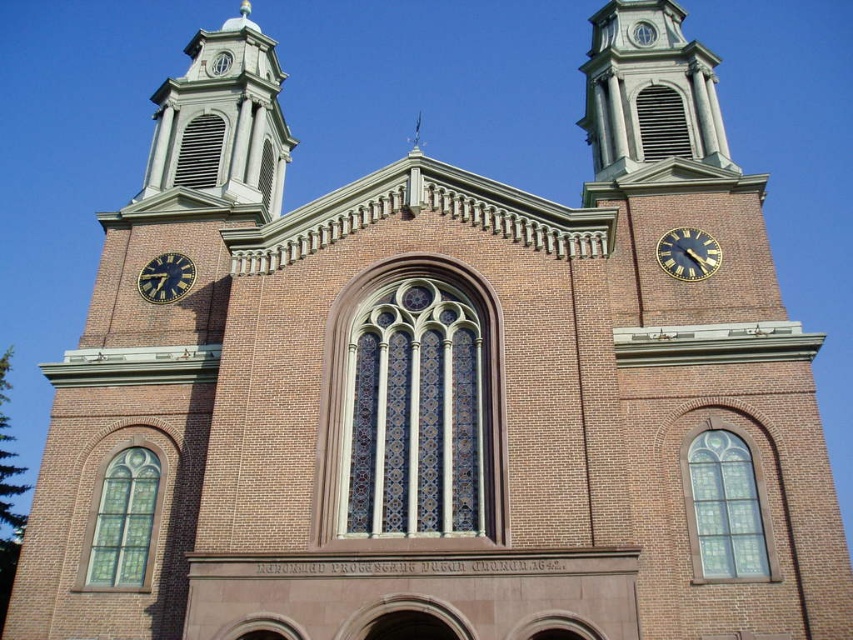
Question: Which of the following is the closest to the observer?

Choices:
 (A) gold metallic clock at upper right
 (B) gold metallic clock at lower left

Answer: (A)

Question: Can you confirm if gold metallic clock at upper right is smaller than gold metallic clock at lower left?

Choices:
 (A) no
 (B) yes

Answer: (A)

Question: Does gold metallic clock at upper right come in front of gold metallic clock at lower left?

Choices:
 (A) yes
 (B) no

Answer: (A)

Question: Can you confirm if gold metallic clock at upper right is thinner than gold metallic clock at lower left?

Choices:
 (A) yes
 (B) no

Answer: (A)